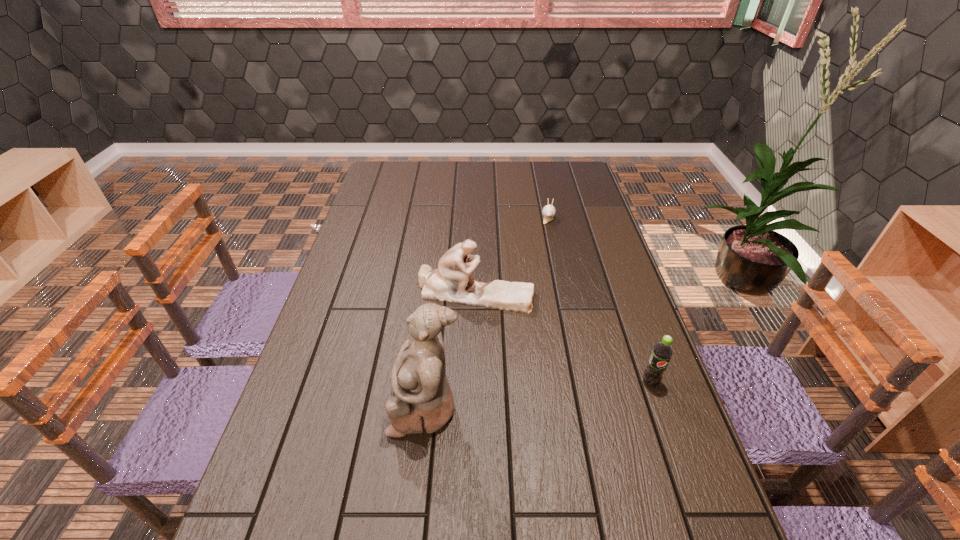
The height and width of the screenshot is (540, 960). Find the location of `free space on the desktop that is between the taller figurine and the soda and is positioned on the shell of the third object from left to right`. free space on the desktop that is between the taller figurine and the soda and is positioned on the shell of the third object from left to right is located at coordinates (532, 395).

Locate an element on the screen. The height and width of the screenshot is (540, 960). free space on the desktop that is between the taller figurine and the soda and is positioned on the front-facing side of the third nearest object is located at coordinates (569, 391).